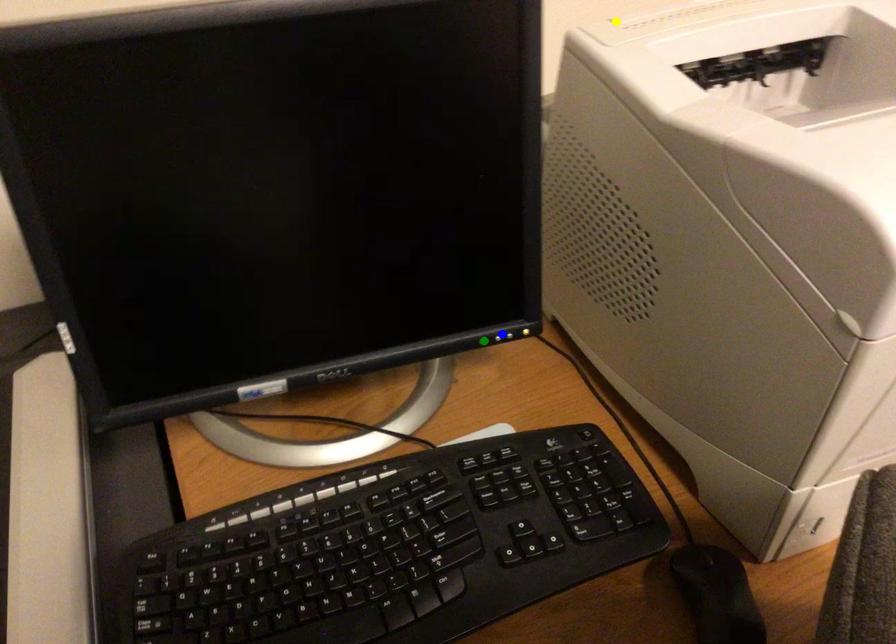
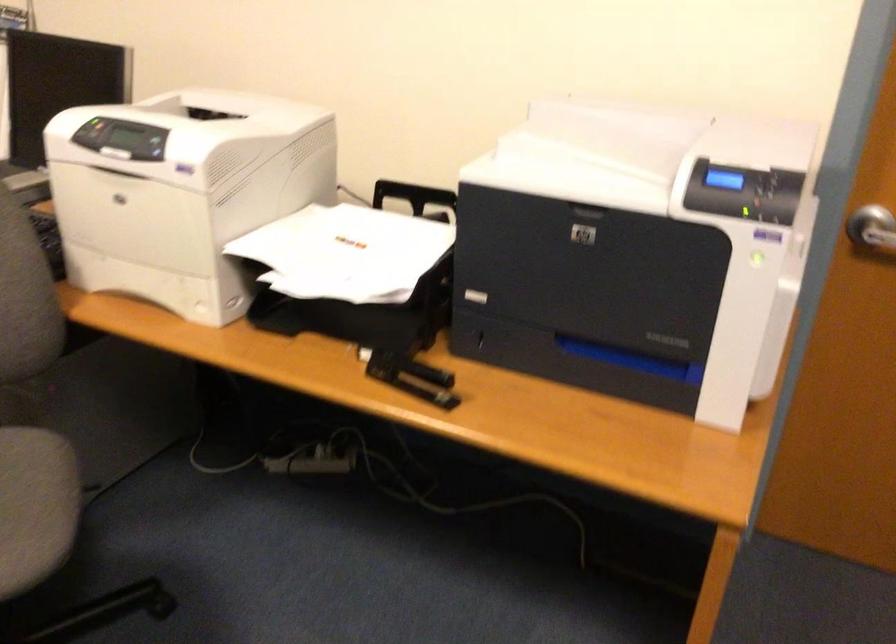
I am providing you with two images of the same scene from different viewpoints. Three points are marked in image1. Which point corresponds to a part or object that is occluded in image2?In image1, three points are marked. Which of them correspond to a part or object that is occluded in image2?Among the three points shown in image1, which one corresponds to a part or object that is no longer visible due to occlusion in image2?

blue point, green point, yellow point